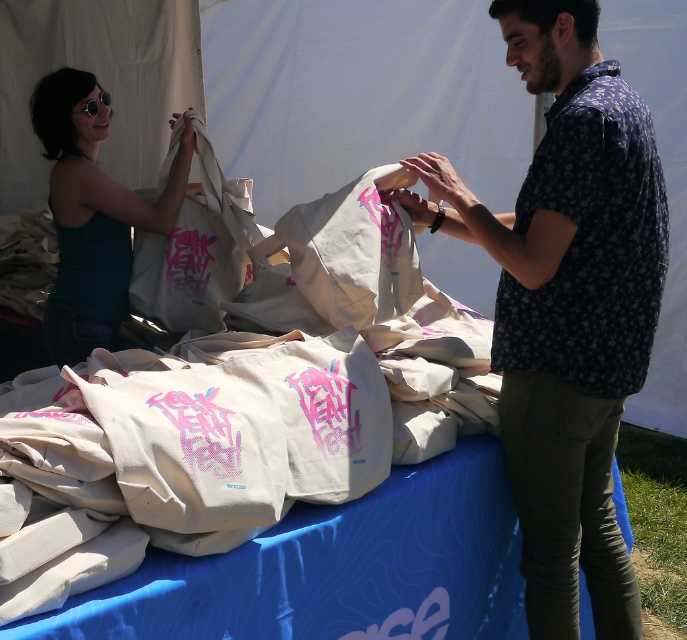
Question: Which point appears farthest from the camera in this image?

Choices:
 (A) (532, 92)
 (B) (56, 196)

Answer: (B)

Question: Which point is closer to the camera taking this photo?

Choices:
 (A) (52, 307)
 (B) (540, 416)

Answer: (B)

Question: Is floral shirt at center thinner than matte white tote bag at left?

Choices:
 (A) no
 (B) yes

Answer: (A)

Question: Does floral shirt at center appear under matte white tote bag at left?

Choices:
 (A) no
 (B) yes

Answer: (B)

Question: Is floral shirt at center wider than matte white tote bag at left?

Choices:
 (A) no
 (B) yes

Answer: (B)